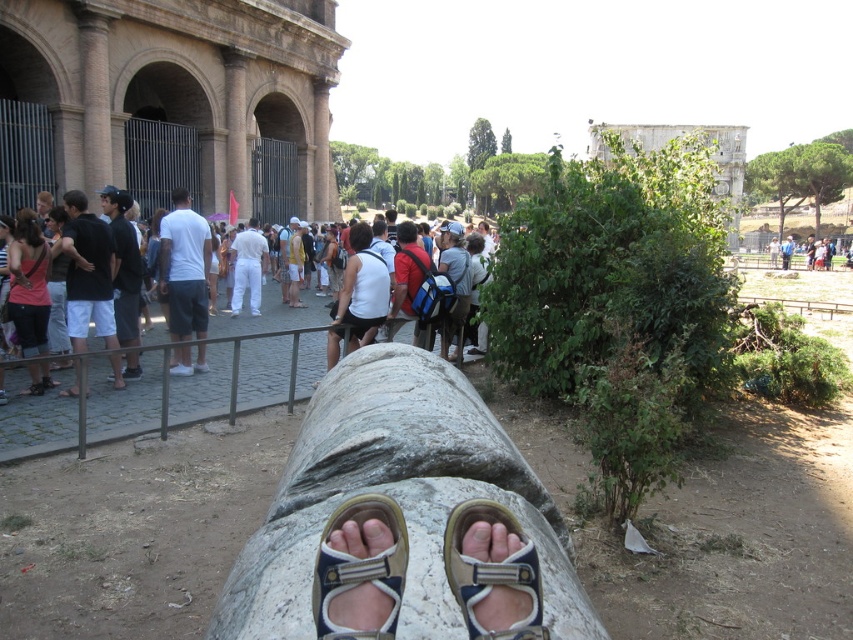
Question: Which object appears closest to the camera in this image?

Choices:
 (A) white rough log at center
 (B) tan fabric sandal at center

Answer: (B)

Question: Considering the real-world distances, which object is closest to the white rough log at center?

Choices:
 (A) white cotton shirt at center
 (B) matte pink tank top at left

Answer: (B)

Question: Can you confirm if white rough log at center is positioned below white cotton shirt at center?

Choices:
 (A) yes
 (B) no

Answer: (A)

Question: Does white rough log at center have a greater width compared to matte pink tank top at left?

Choices:
 (A) no
 (B) yes

Answer: (B)

Question: Among these points, which one is nearest to the camera?

Choices:
 (A) (22, 268)
 (B) (434, 378)

Answer: (B)

Question: Is white rough log at center above blue fabric sandal at center?

Choices:
 (A) no
 (B) yes

Answer: (A)